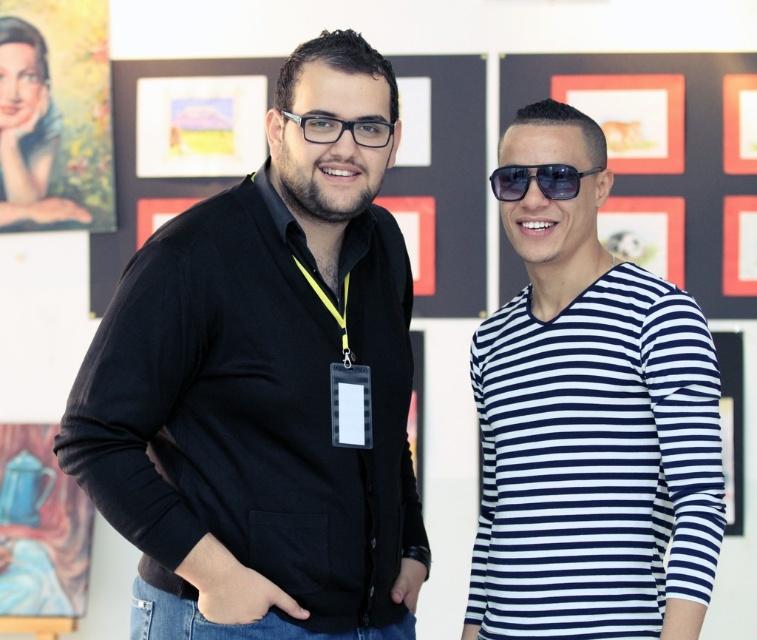
You are a photographer setting up for a group photo at an art exhibition. You need to ensure that the black matte cardigan at left and the white striped shirt at right are both clearly visible in the frame. Given that the minimum focus distance for your camera is 16 inches, will you be able to capture both subjects in focus without adjusting your position?

The black matte cardigan at left is 17.10 inches away from the white striped shirt at right, which exceeds the camera minimum focus distance of 16 inches. Therefore, both subjects will be in focus without needing to adjust your position.

You are a photographer trying to capture a clear shot of the transparent plastic glasses at center without the black matte cardigan at left blocking it. What should you do?

The black matte cardigan at left is in front of the transparent plastic glasses at center, so you should move your camera angle to the right to avoid the obstruction caused by the black matte cardigan at left.